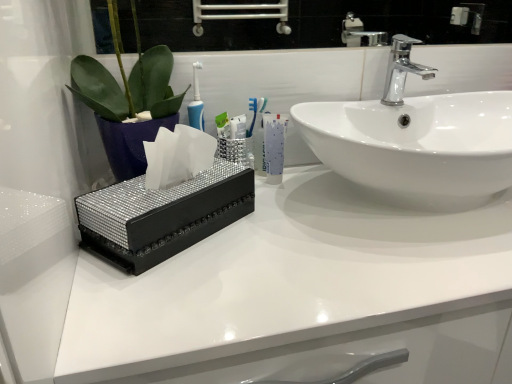
Where is `vacant area that lies between white glossy sink at center and sparkly black tissue box at center`? This screenshot has height=384, width=512. vacant area that lies between white glossy sink at center and sparkly black tissue box at center is located at coordinates (250, 235).